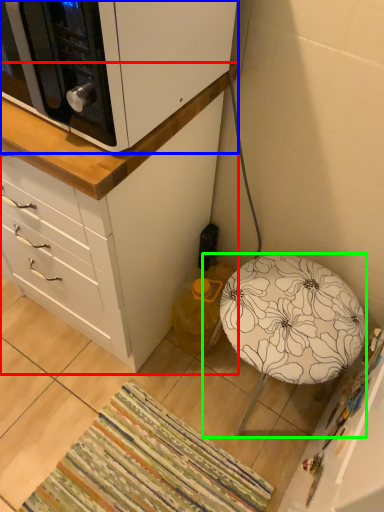
Question: Based on their relative distances, which object is farther from chest of drawers (highlighted by a red box)? Choose from cabinetry (highlighted by a blue box) and furniture (highlighted by a green box).

Choices:
 (A) cabinetry
 (B) furniture

Answer: (B)